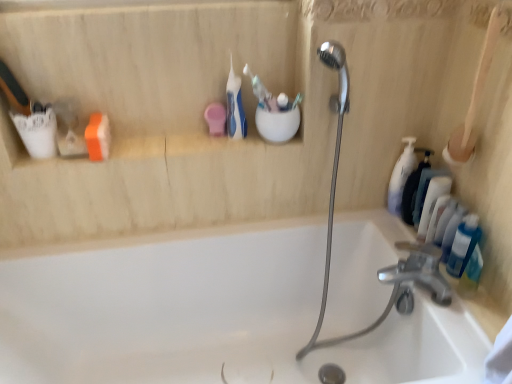
I want to click on free space in front of blue translucent bottle at right, the fourth toiletry when ordered from left to right, so click(470, 329).